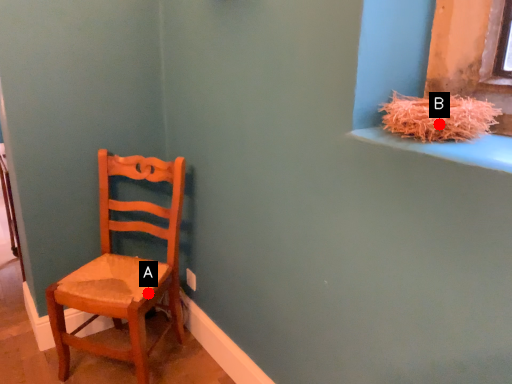
Question: Two points are circled on the image, labeled by A and B beside each circle. Which point is farther from the camera taking this photo?

Choices:
 (A) A is further
 (B) B is further

Answer: (A)